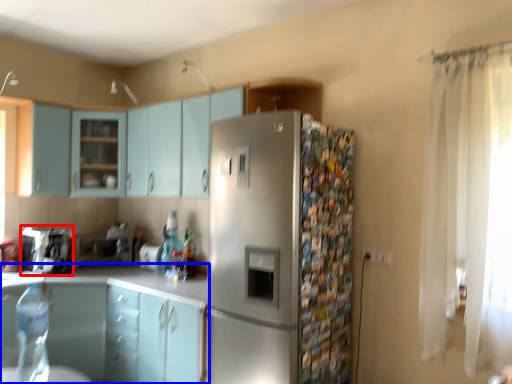
Question: Among these objects, which one is nearest to the camera, appliance (highlighted by a red box) or cabinetry (highlighted by a blue box)?

Choices:
 (A) appliance
 (B) cabinetry

Answer: (B)